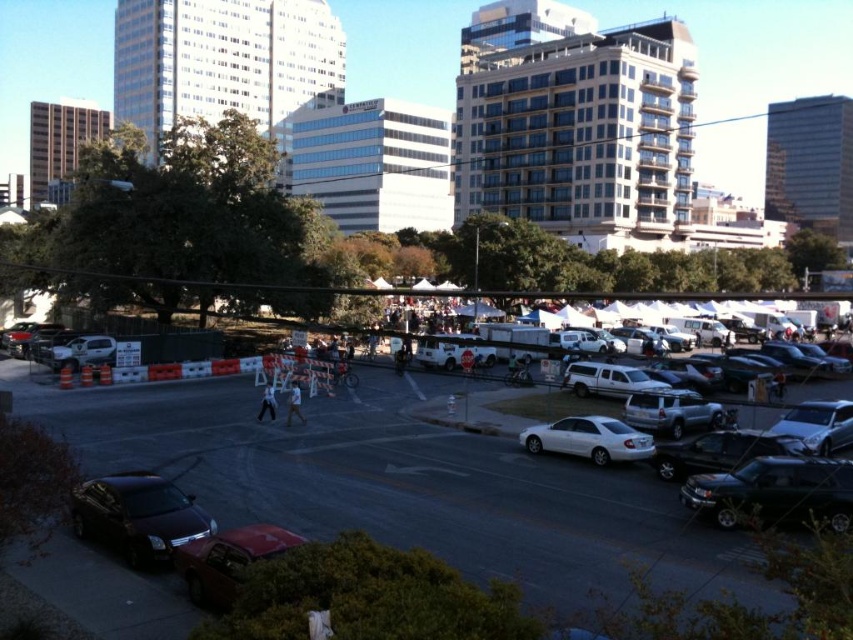
Question: Which object appears closest to the camera in this image?

Choices:
 (A) satin silver suv at lower right
 (B) white matte truck at center

Answer: (A)

Question: Which point is closer to the camera taking this photo?

Choices:
 (A) (543, 436)
 (B) (712, 404)
 (C) (660, 465)
 (D) (83, 484)

Answer: (D)

Question: Does satin silver suv at lower right have a larger size compared to matte white truck at left?

Choices:
 (A) no
 (B) yes

Answer: (B)

Question: Does shiny black suv at lower right have a lesser width compared to white matte truck at center?

Choices:
 (A) no
 (B) yes

Answer: (A)

Question: Is shiny dark gray sedan at lower left further to camera compared to matte white truck at left?

Choices:
 (A) yes
 (B) no

Answer: (B)

Question: Which of the following is the farthest from the observer?

Choices:
 (A) (598, 449)
 (B) (106, 349)
 (C) (792, 493)

Answer: (B)